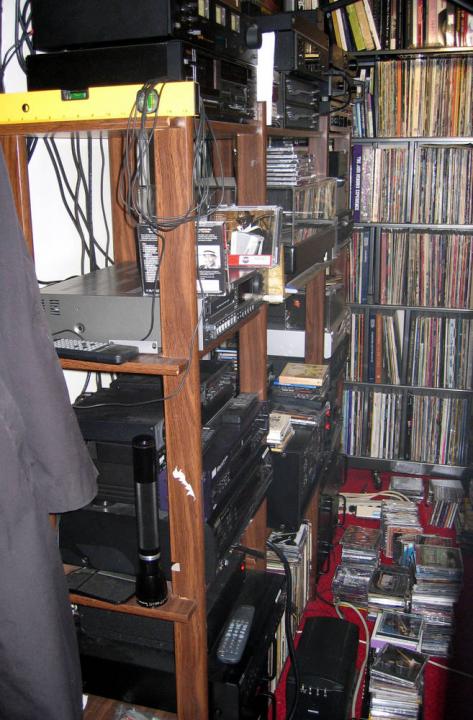
The width and height of the screenshot is (473, 720). In order to click on wall in this screenshot , I will do `click(52, 235)`.